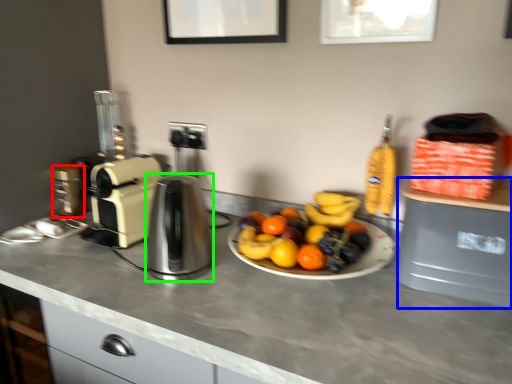
Question: Considering the real-world distances, which object is farthest from coffee machine (highlighted by a red box)? appliance (highlighted by a blue box) or kitchen appliance (highlighted by a green box)?

Choices:
 (A) appliance
 (B) kitchen appliance

Answer: (A)